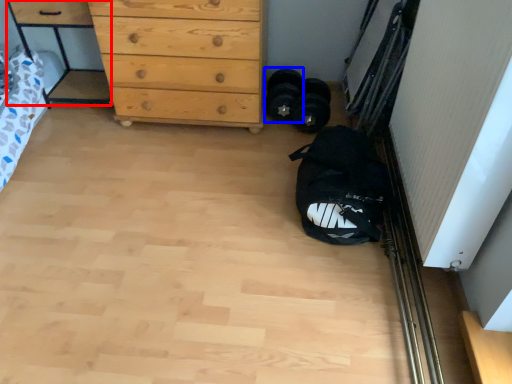
Question: Which object appears closest to the camera in this image, cabinetry (highlighted by a red box) or footwear (highlighted by a blue box)?

Choices:
 (A) cabinetry
 (B) footwear

Answer: (A)